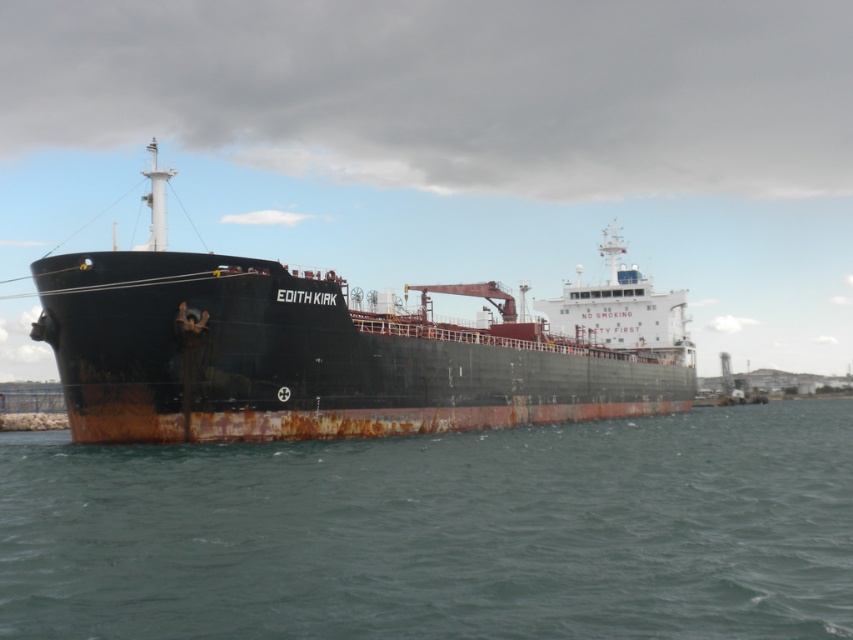
Does rusty water at lower center have a larger size compared to rusty metal ship at center?

Actually, rusty water at lower center might be smaller than rusty metal ship at center.

Based on the photo, can you confirm if rusty water at lower center is positioned below rusty metal ship at center?

Indeed, rusty water at lower center is positioned under rusty metal ship at center.

Measure the distance between point (578, 596) and camera.

33.90 meters

Identify the location of rusty water at lower center. This screenshot has height=640, width=853. (440, 532).